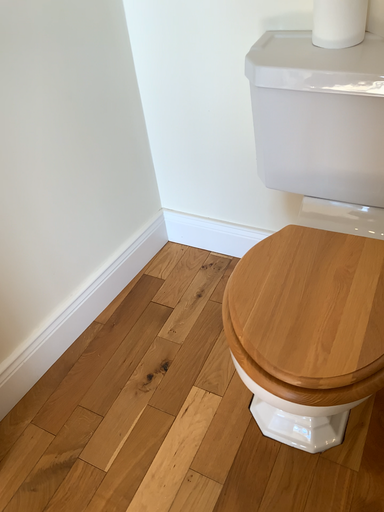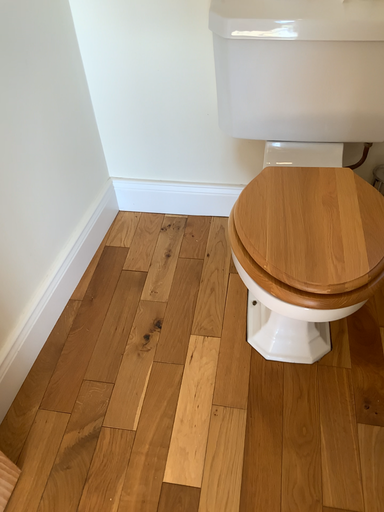
Question: How did the camera likely rotate when shooting the video?

Choices:
 (A) rotated right
 (B) rotated left

Answer: (A)